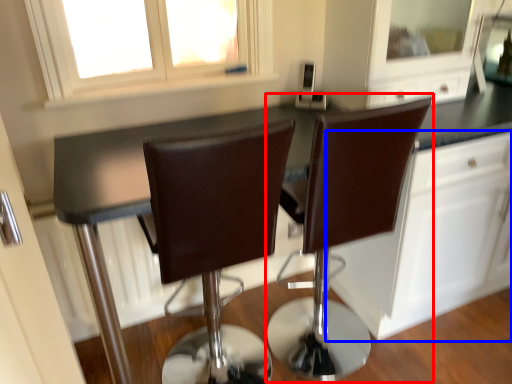
Question: Which object is closer to the camera taking this photo, chair (highlighted by a red box) or cabinetry (highlighted by a blue box)?

Choices:
 (A) chair
 (B) cabinetry

Answer: (A)